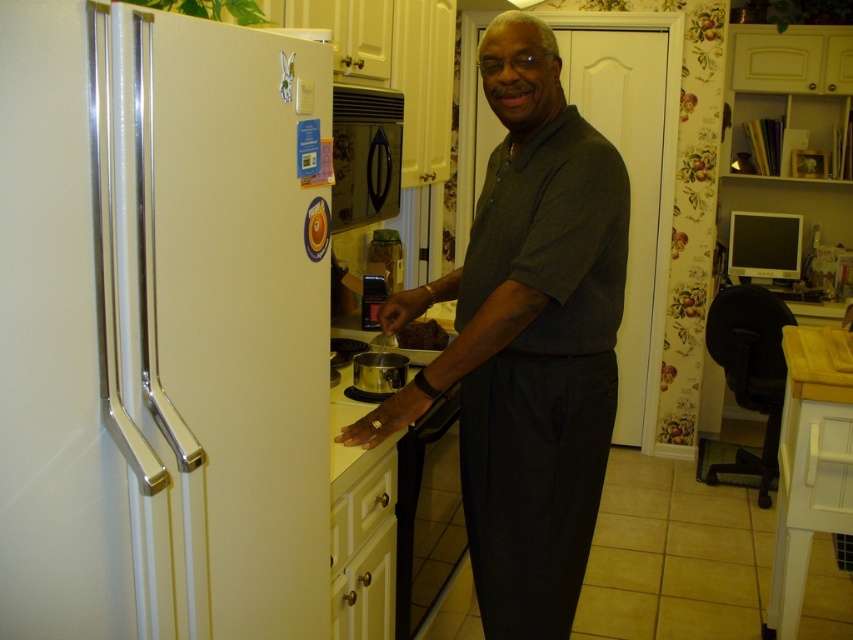
You are standing in the kitchen and see two points marked in the scene. Which point is closer to you, point (33, 332) or point (505, 550)?

Point (33, 332) is in front of point (505, 550), so it is closer to you.

You are a delivery person who needs to place a small package on the counter between the dark gray shirt at center and the satin silver pot at center. Can you fit it there?

The dark gray shirt at center is bigger than the satin silver pot at center, so there may not be enough space between them to fit a small package. Please check the available space carefully.

Where is the dark gray shirt at center located in the image?

The dark gray shirt at center is located at point coordinates of approximately 0.533 on the x axis and 0.619 on the y axis.